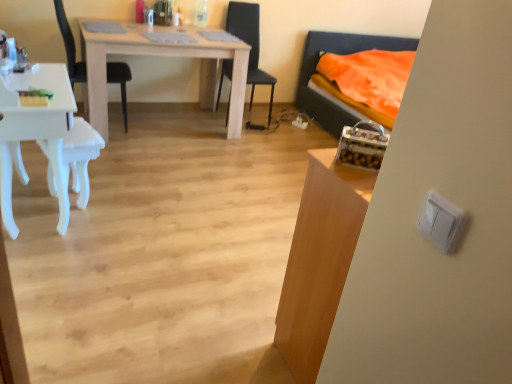
You are a GUI agent. You are given a task and a screenshot of the screen. Output one action in this format:
    pyautogui.click(x=<x>, y=<y>)
    Task: Click on the free space to the back side of white glossy desk at left
    The image size is (512, 384).
    Given the screenshot: What is the action you would take?
    pyautogui.click(x=120, y=170)